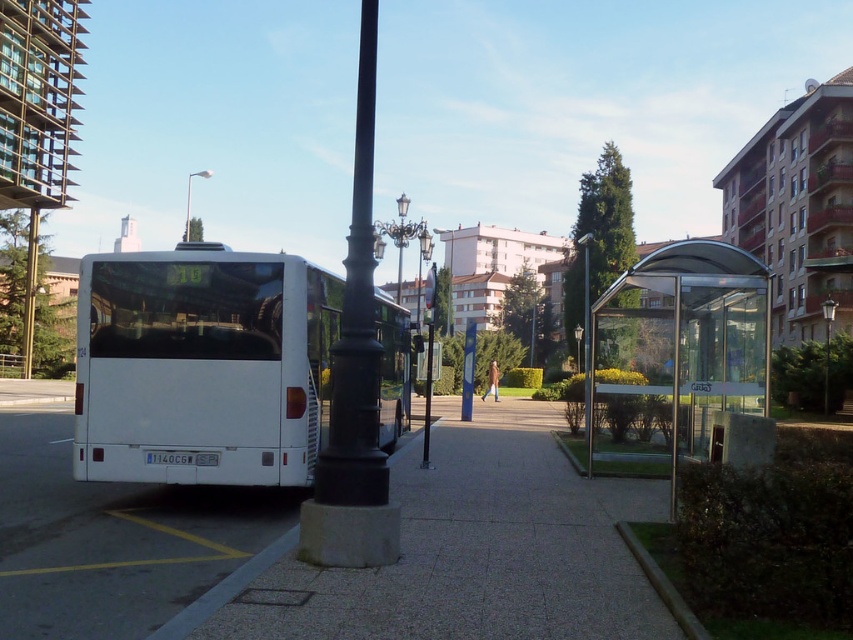
Question: Is smooth concrete pavement at center to the right of black cast iron pole at center from the viewer's perspective?

Choices:
 (A) yes
 (B) no

Answer: (A)

Question: Which is farther from the metallic pole at upper center?

Choices:
 (A) polished brass streetlight at center
 (B) smooth concrete pavement at center

Answer: (B)

Question: Is smooth concrete pavement at center thinner than metallic pole at right?

Choices:
 (A) yes
 (B) no

Answer: (A)

Question: Among these points, which one is nearest to the camera?

Choices:
 (A) (401, 198)
 (B) (248, 616)
 (C) (276, 337)

Answer: (B)

Question: Where is smooth concrete pavement at center located in relation to transparent glass bus stop at right in the image?

Choices:
 (A) below
 (B) above

Answer: (A)

Question: Which object is the farthest from the white matte bus at left?

Choices:
 (A) polished brass streetlight at center
 (B) transparent glass bus stop at right
 (C) black cast iron pole at center

Answer: (A)